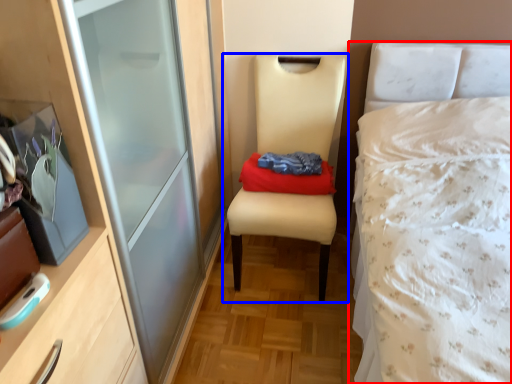
Question: Which object appears farthest to the camera in this image, bed (highlighted by a red box) or chair (highlighted by a blue box)?

Choices:
 (A) bed
 (B) chair

Answer: (B)